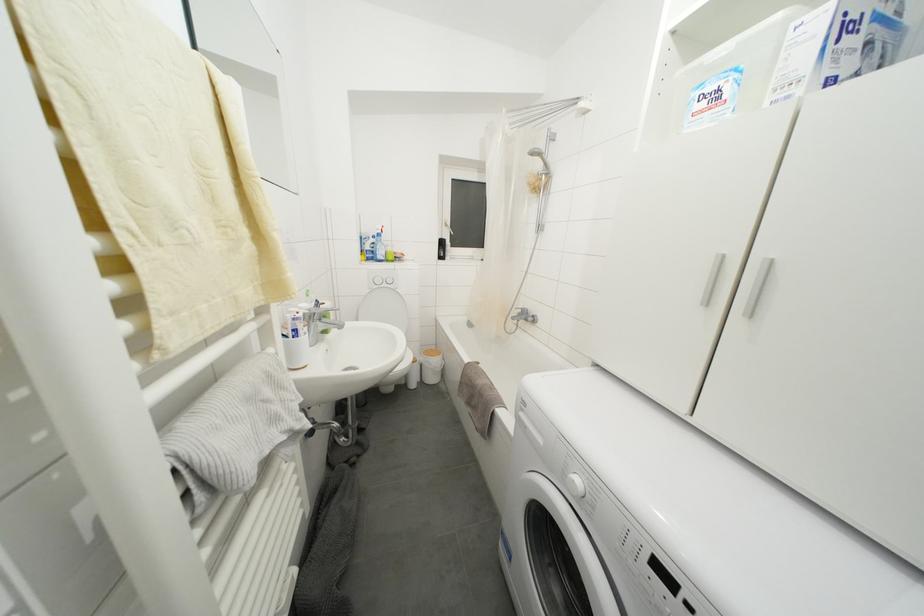
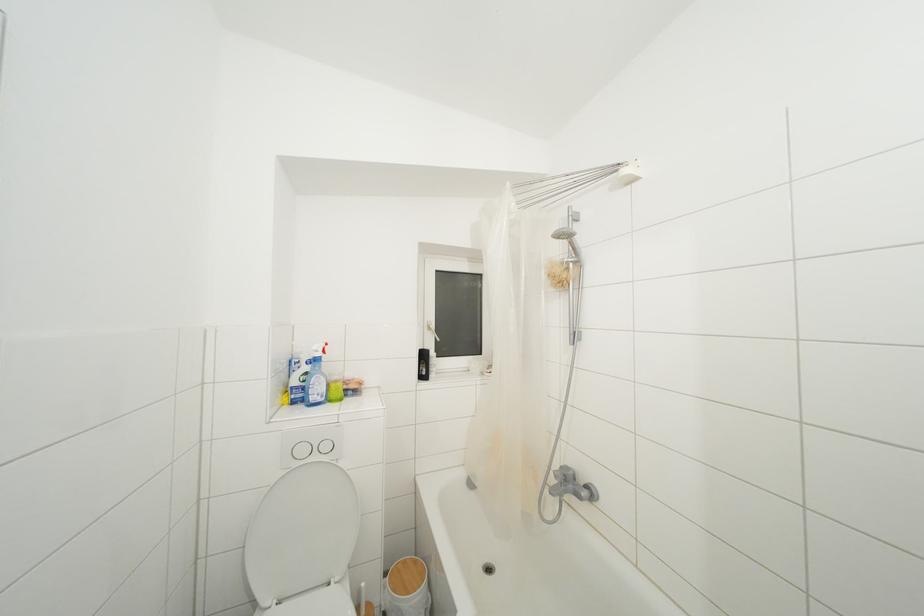
Where in the second image is the point corresponding to (445,248) from the first image?

(428, 361)